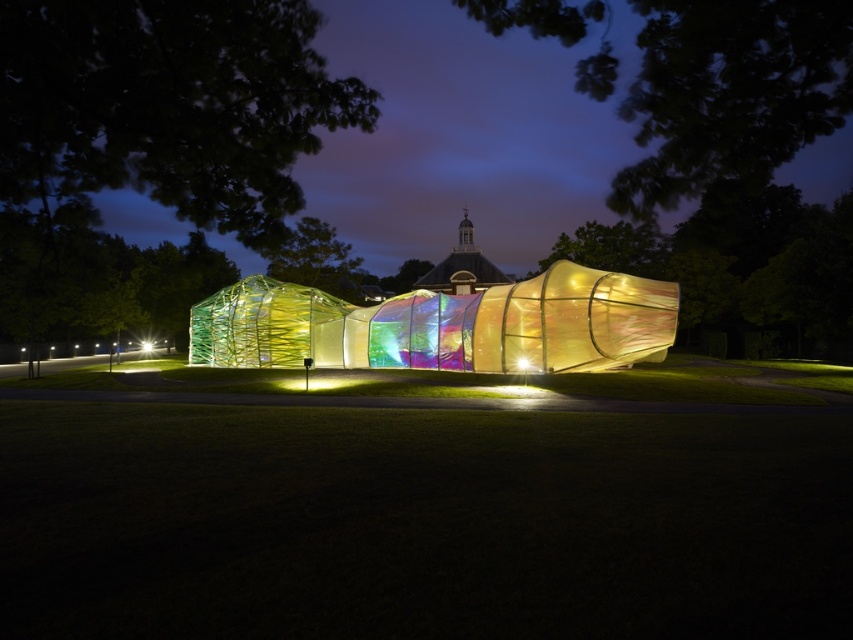
You are standing in front of the illuminated art installation and want to determine the relative positions of two points on it. The points are labeled as point 1 at coordinates point (418,353) and point 2 at coordinates point (521,365). Which point is closer to you?

Point (418,353) is closer to you because it is further to the viewer than point (521,365).

You are an event planner trying to set up a photo booth near the iridescent fabric tent at center and the transparent fabric at center. Since you want the booth to be visible in photos, which fabric should you place the booth in front of to ensure it appears in front of both?

You should place the booth in front of the transparent fabric at center because the iridescent fabric tent at center is already in front of it, so positioning the booth in front of the transparent fabric at center will place it in front of both.

You are an event planner setting up a photo shoot at the nighttime art installation. You need to place a large camera tripod in a spot where it won not block the view of the iridescent fabric tent at center and the transparent fabric at center. Where should you position the tripod?

The iridescent fabric tent at center is positioned over the transparent fabric at center. To avoid blocking the view of both, place the tripod to the side or behind the installation where it won not obstruct the line of sight to either object.